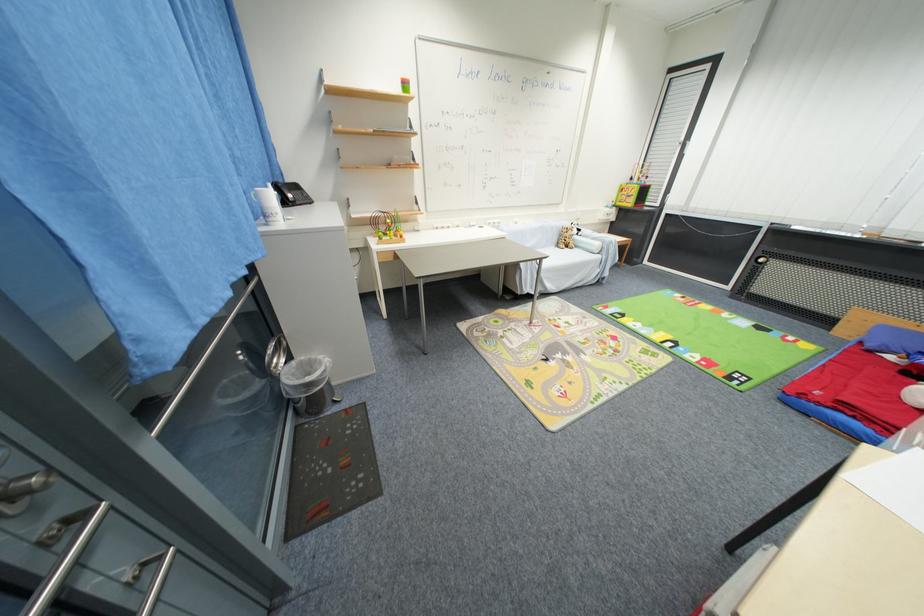
Find where to turn the silver door handle. Please return your answer as a coordinate pair (x, y).

(75, 554)